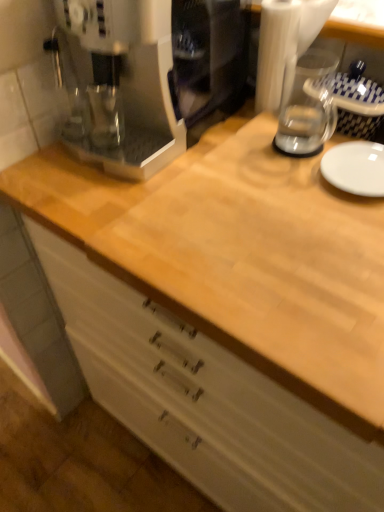
Question: Considering the positions of transparent glass blender at upper right and white glossy plate at right in the image, is transparent glass blender at upper right wider or thinner than white glossy plate at right?

Choices:
 (A) wide
 (B) thin

Answer: (B)

Question: Visually, is transparent glass blender at upper right positioned to the left or to the right of white glossy plate at right?

Choices:
 (A) left
 (B) right

Answer: (A)

Question: Considering the real-world distances, which object is farthest from the transparent glass blender at upper right?

Choices:
 (A) natural wood cabinet at center
 (B) white glossy plate at right

Answer: (A)

Question: Considering the real-world distances, which object is farthest from the white glossy plate at right?

Choices:
 (A) transparent glass blender at upper right
 (B) natural wood cabinet at center

Answer: (B)